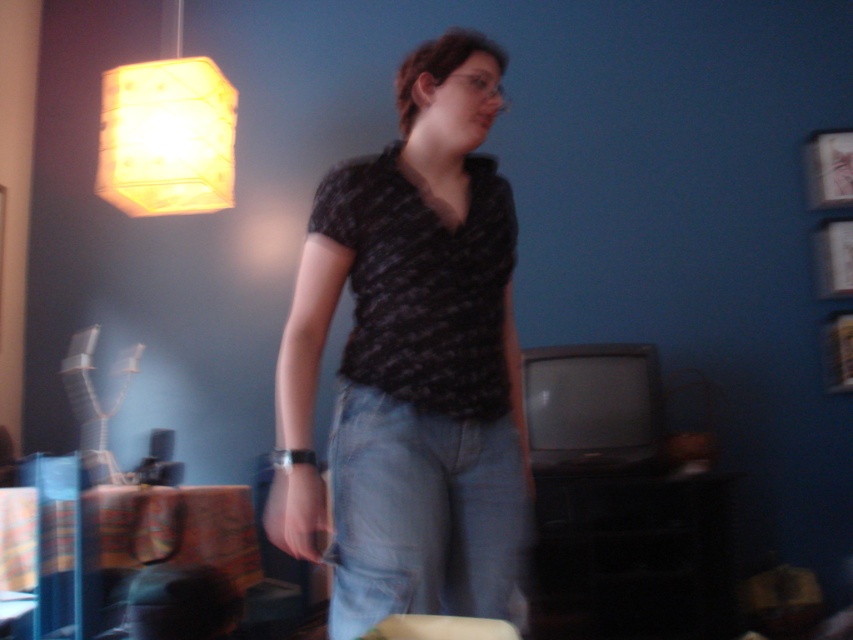
Can you confirm if matte black shirt at center is thinner than yellow paper lampshade at upper left?

No.

In the scene shown: Does matte black shirt at center come in front of yellow paper lampshade at upper left?

Yes, it is in front of yellow paper lampshade at upper left.

Who is more distant from viewer, [483,56] or [148,129]?

The point [148,129] is more distant.

The image size is (853, 640). In order to click on matte black shirt at center in this screenshot , I will do `click(413, 364)`.